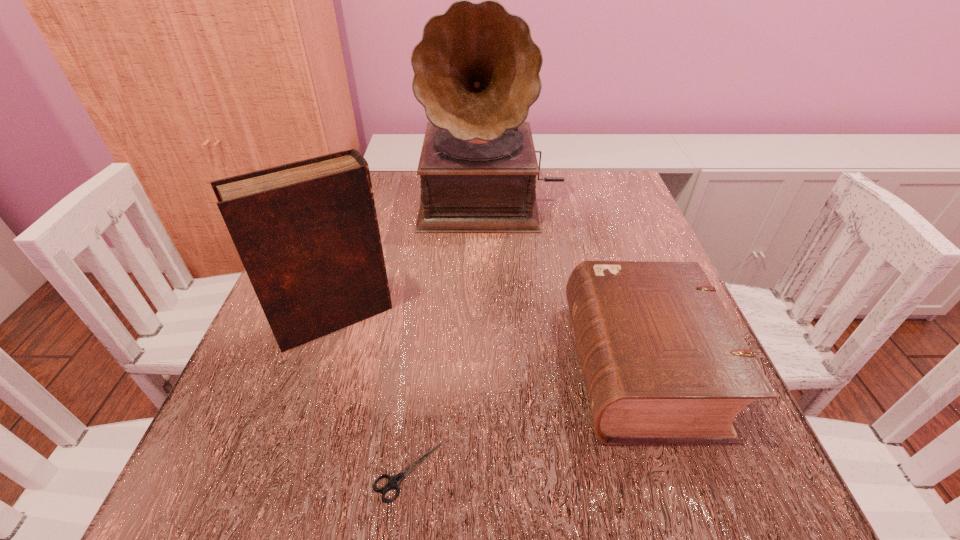
The width and height of the screenshot is (960, 540). In order to click on vacant area located 0.270m on the spine side of the right Bible in this screenshot , I will do `click(404, 366)`.

Find the location of a particular element. This screenshot has width=960, height=540. vacant space located 0.220m on the spine side of the right Bible is located at coordinates (435, 366).

Locate an element on the screen. Image resolution: width=960 pixels, height=540 pixels. free space located on the back of the shears is located at coordinates click(427, 315).

This screenshot has height=540, width=960. I want to click on object located in the far edge section of the desktop, so click(476, 69).

Where is `object located in the near edge section of the desktop`? The width and height of the screenshot is (960, 540). object located in the near edge section of the desktop is located at coordinates (394, 481).

Find the location of a particular element. The width and height of the screenshot is (960, 540). object that is positioned at the left edge is located at coordinates (307, 233).

Find the location of `object present at the right edge`. object present at the right edge is located at coordinates (663, 362).

The height and width of the screenshot is (540, 960). In the image, there is a desktop. Identify the location of free space at the far edge. (407, 174).

Identify the location of free space at the near edge. (555, 460).

Locate an element on the screen. The width and height of the screenshot is (960, 540). vacant area at the left edge of the desktop is located at coordinates (324, 336).